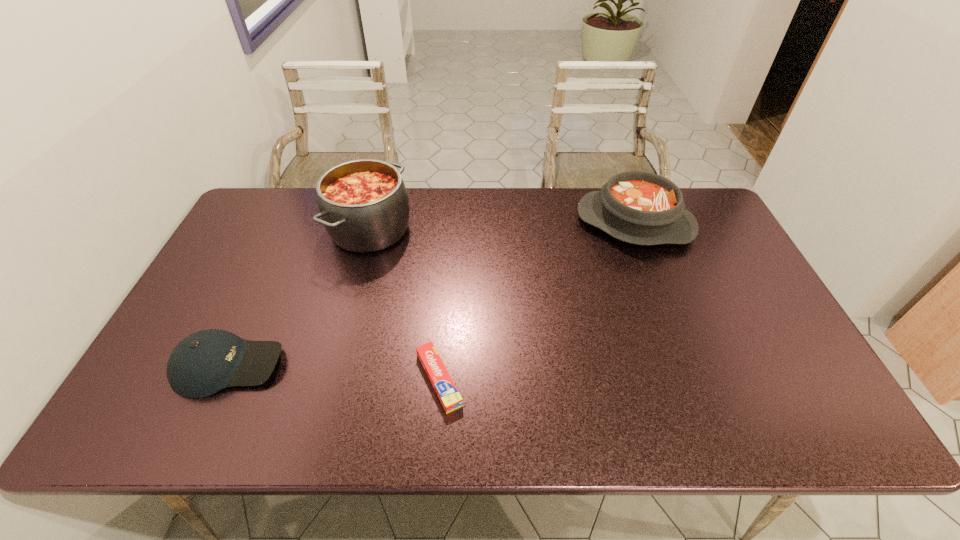
At what (x,y) coordinates should I click in order to perform the action: click on the taller casserole. Please return your answer as a coordinate pair (x, y). Image resolution: width=960 pixels, height=540 pixels. Looking at the image, I should click on (364, 206).

Identify the location of the left casserole. This screenshot has width=960, height=540. (364, 206).

This screenshot has height=540, width=960. I want to click on the right casserole, so click(x=637, y=207).

At what (x,y) coordinates should I click in order to perform the action: click on the second tallest object. Please return your answer as a coordinate pair (x, y). The height and width of the screenshot is (540, 960). Looking at the image, I should click on (637, 207).

Where is `baseball cap`? This screenshot has height=540, width=960. baseball cap is located at coordinates (205, 362).

Where is `toothpaste`? toothpaste is located at coordinates (450, 398).

Locate an element on the screen. This screenshot has width=960, height=540. the shortest object is located at coordinates (450, 398).

Where is `vacant space located 0.320m on the front of the taller casserole`? The height and width of the screenshot is (540, 960). vacant space located 0.320m on the front of the taller casserole is located at coordinates (336, 356).

The image size is (960, 540). I want to click on free spot located on the left of the rightmost object, so click(x=507, y=223).

Find the location of a particular element. The width and height of the screenshot is (960, 540). free space located on the front-facing side of the second shortest object is located at coordinates (353, 366).